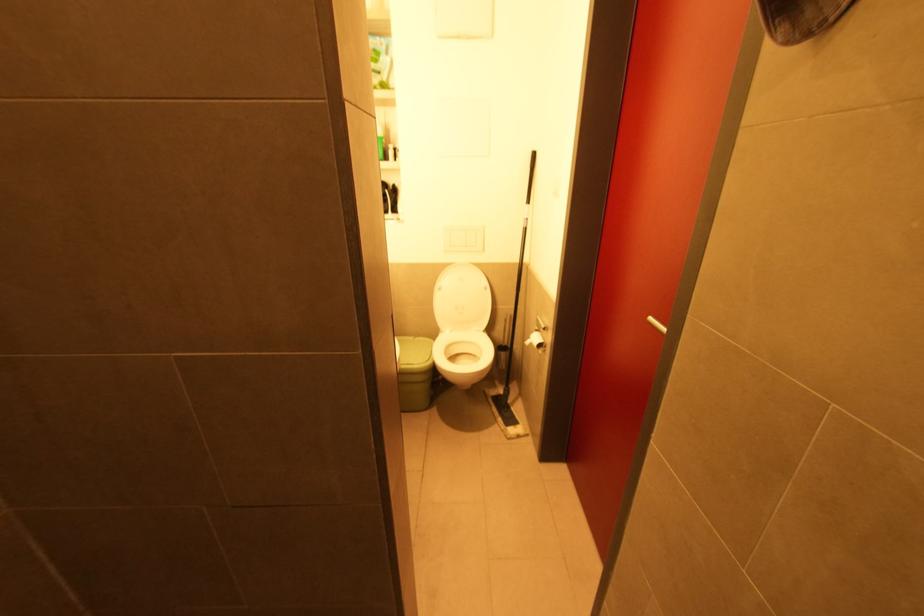
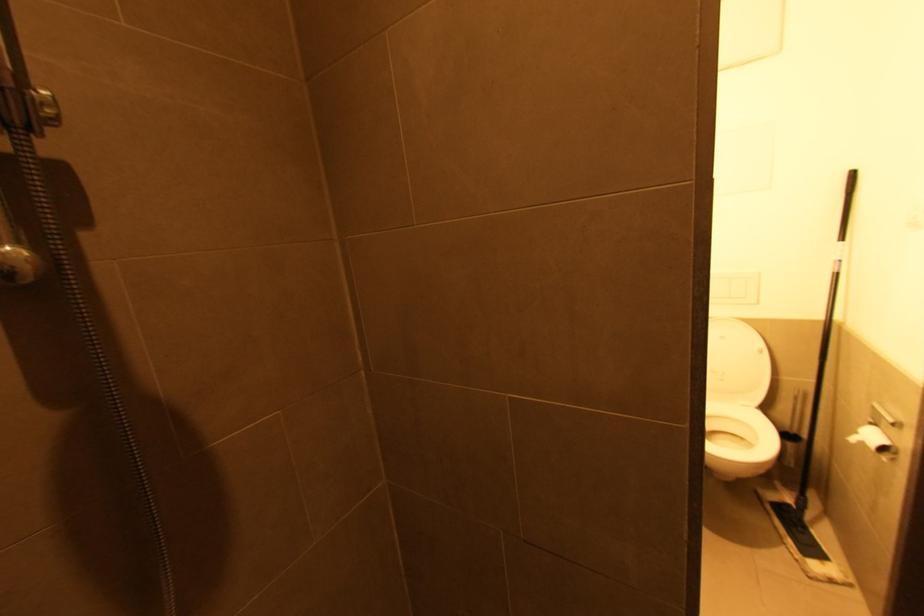
Question: The images are taken continuously from a first-person perspective. In which direction is your viewpoint rotating?

Choices:
 (A) Left
 (B) Right
 (C) Up
 (D) Down

Answer: (A)